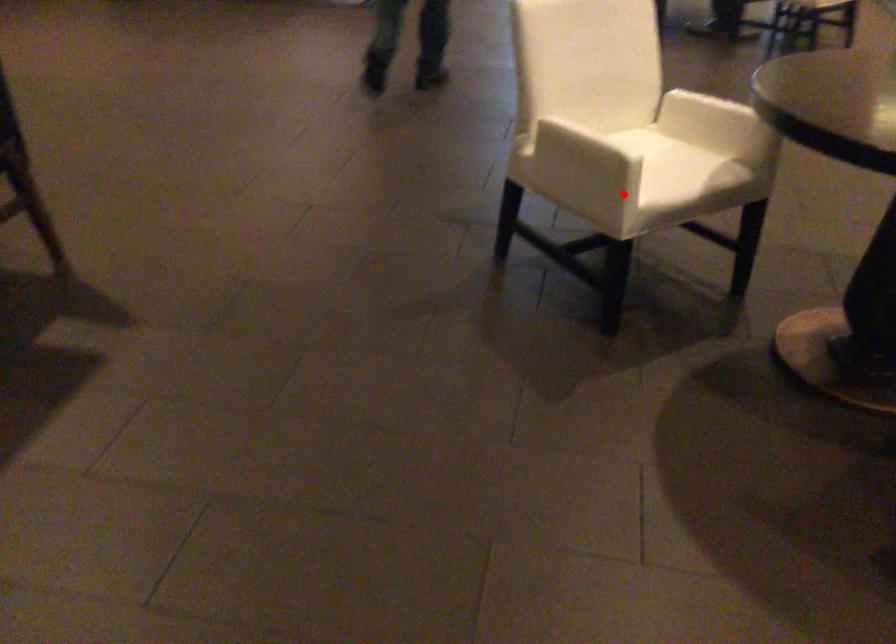
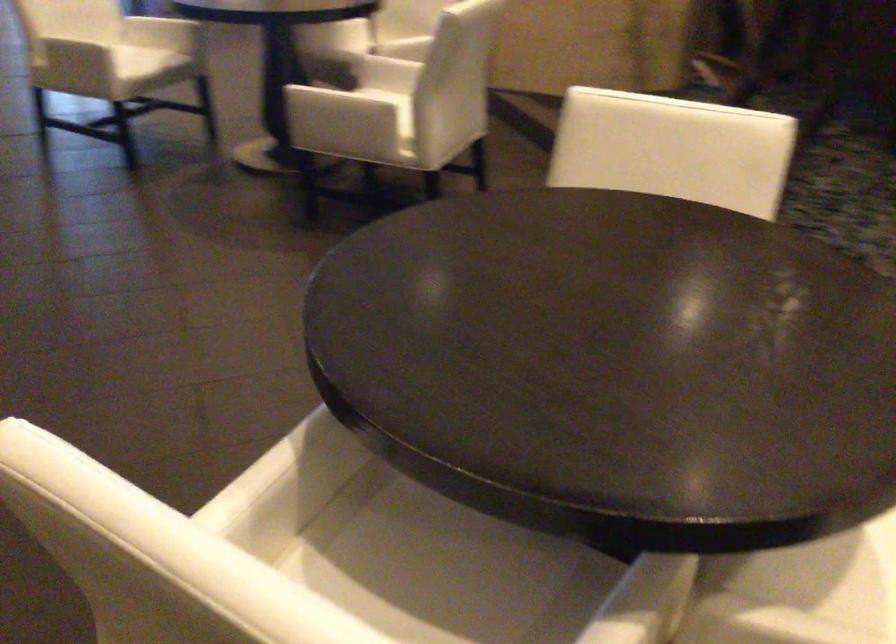
Question: I am providing you with two images of the same scene from different viewpoints. In image1, a red point is highlighted. Considering the same 3D point in image2, which of the following is correct?

Choices:
 (A) It is closer
 (B) It is farther

Answer: (B)